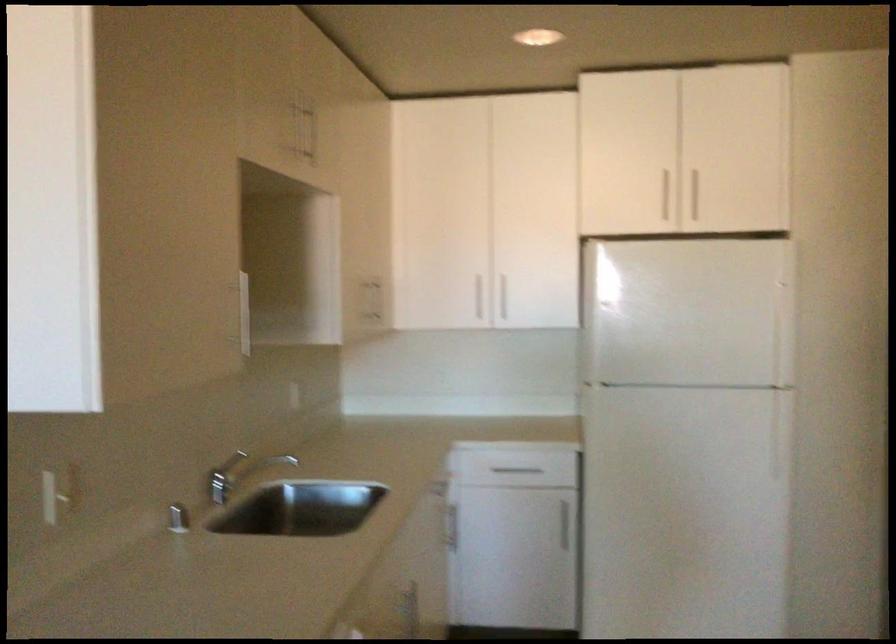
What do you see at coordinates (513, 469) in the screenshot? I see `a metal drawer handle` at bounding box center [513, 469].